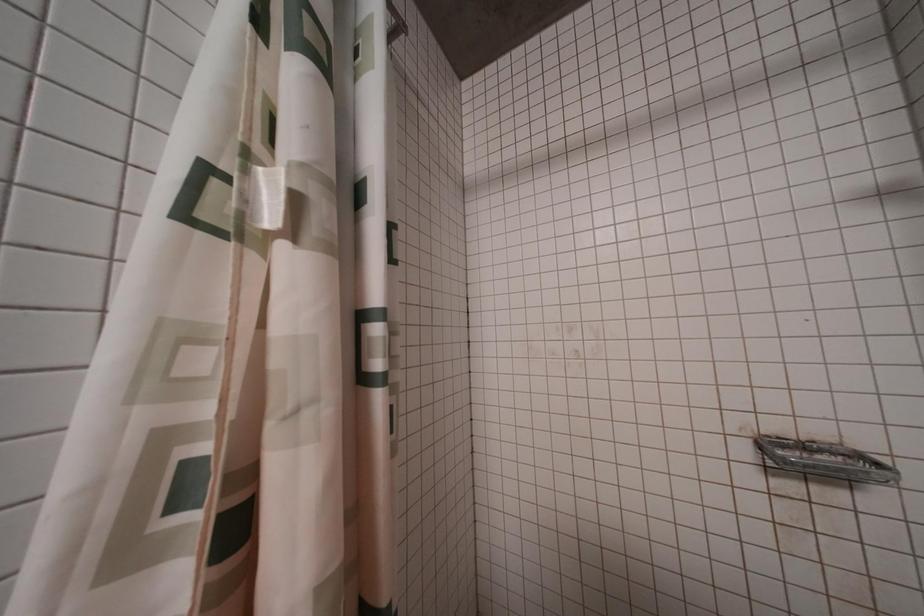
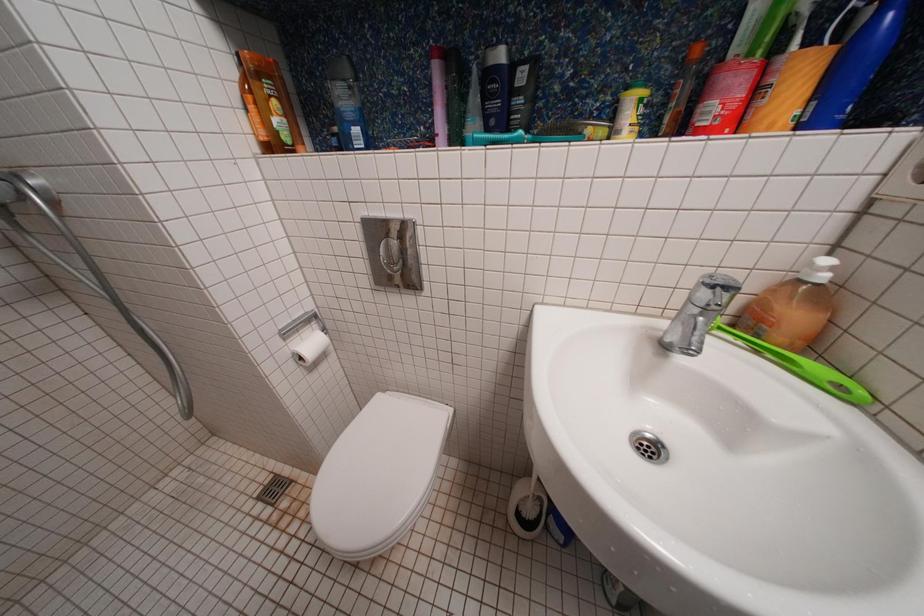
Based on the continuous images, in which direction is the camera rotating?

The camera rotated toward right-down.